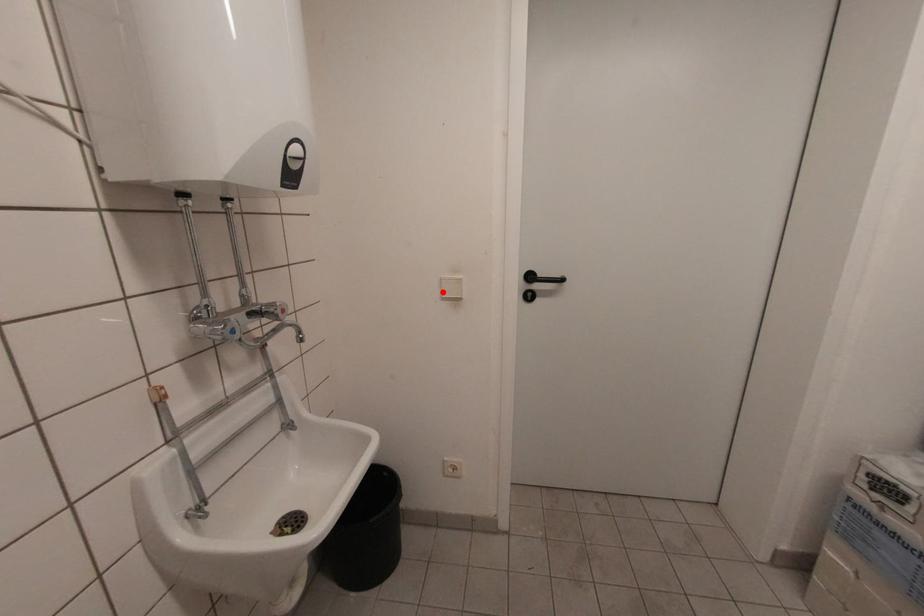
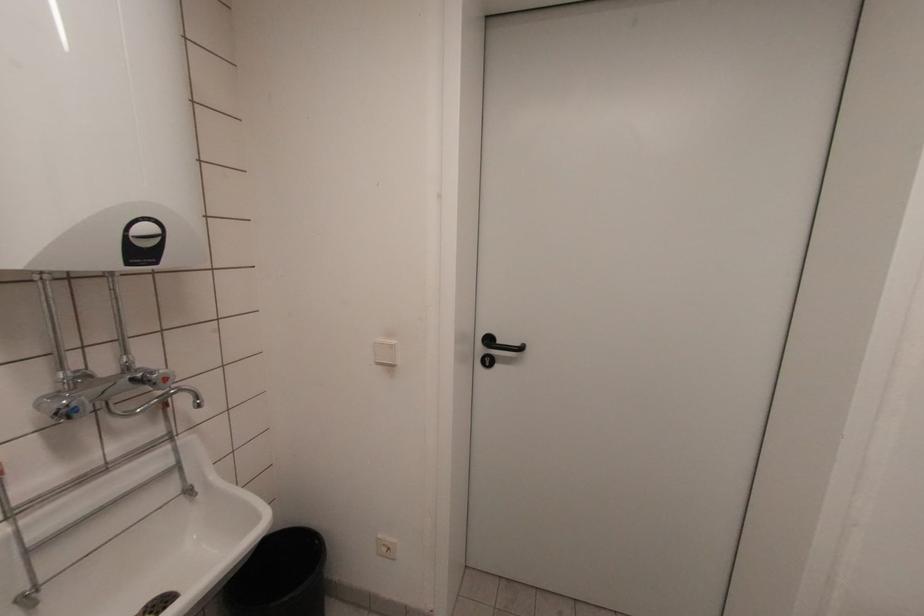
Find the pixel in the second image that matches the highlighted location in the first image.

(375, 355)